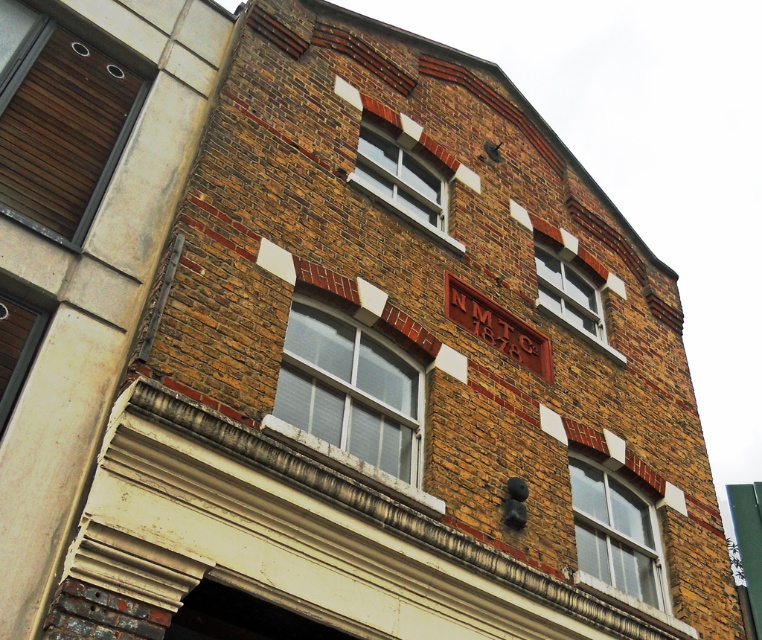
Which is above, clear glass window at center right or white painted wood window at upper center?

white painted wood window at upper center is above.

You are a GUI agent. You are given a task and a screenshot of the screen. Output one action in this format:
    pyautogui.click(x=<x>, y=<y>)
    Task: Click on the clear glass window at center right
    This screenshot has width=762, height=640.
    Given the screenshot: What is the action you would take?
    pyautogui.click(x=613, y=532)

You are a GUI agent. You are given a task and a screenshot of the screen. Output one action in this format:
    pyautogui.click(x=<x>, y=<y>)
    Task: Click on the clear glass window at center right
    The image size is (762, 640).
    Given the screenshot: What is the action you would take?
    pyautogui.click(x=613, y=532)

Is point (319, 406) closer to camera compared to point (556, 307)?

Yes.

Locate an element on the screen. Image resolution: width=762 pixels, height=640 pixels. clear glass window at center is located at coordinates point(351,388).

Is point (392, 436) in front of point (546, 250)?

Yes, it is.

Where is `clear glass window at center`? This screenshot has height=640, width=762. clear glass window at center is located at coordinates (351, 388).

Between point (71, 120) and point (648, 552), which one is positioned in front?

Point (71, 120) is more forward.

Who is shorter, brown wooden window at upper left or clear glass window at center right?

Standing shorter between the two is clear glass window at center right.

Is point (94, 115) behind point (600, 556)?

No, (94, 115) is in front of (600, 556).

This screenshot has height=640, width=762. Find the location of `brown wooden window at upper left`. brown wooden window at upper left is located at coordinates (58, 120).